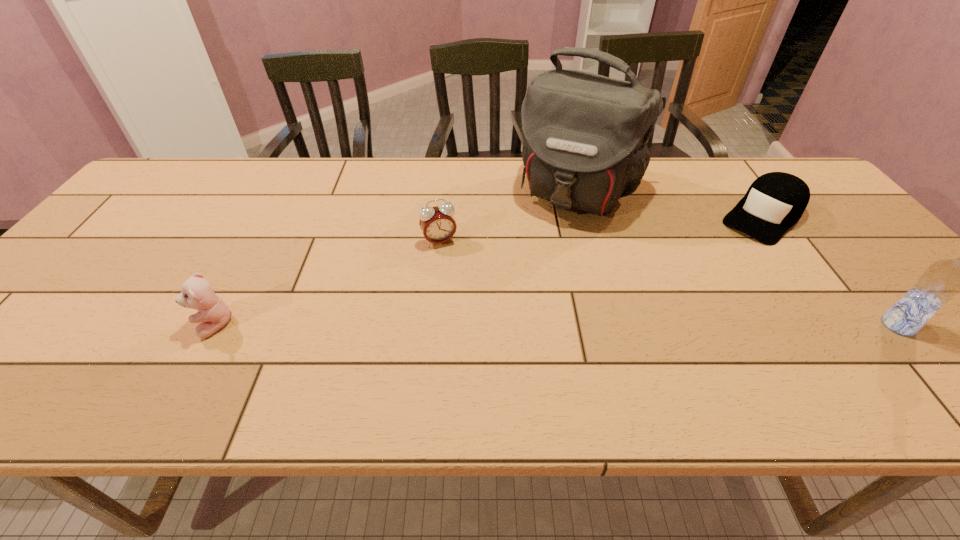
The width and height of the screenshot is (960, 540). Find the location of `empty location between the teddy bear and the third object from left to right`. empty location between the teddy bear and the third object from left to right is located at coordinates (396, 259).

What are the coordinates of `object that stands as the fourth closest to the teddy bear` in the screenshot? It's located at (942, 280).

Identify which object is located as the third nearest to the shortest object. Please provide its 2D coordinates. Your answer should be formatted as a tuple, i.e. [(x, y)], where the tuple contains the x and y coordinates of a point satisfying the conditions above.

[(437, 223)]